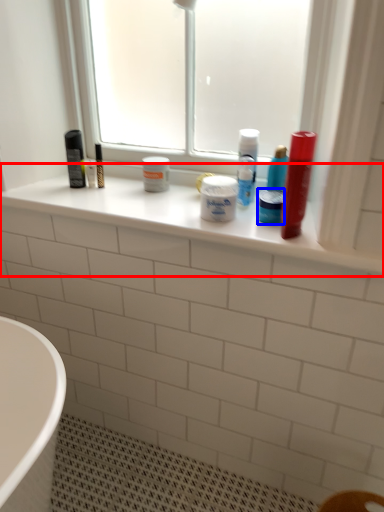
Question: Which point is closer to the camera, window sill (highlighted by a red box) or mouthwash (highlighted by a blue box)?

Choices:
 (A) window sill
 (B) mouthwash

Answer: (A)